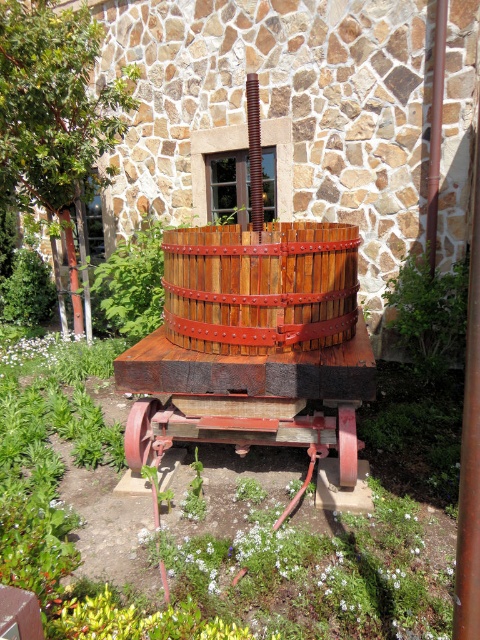
Question: Which point is farther to the camera?

Choices:
 (A) wooden barrel at center
 (B) white matte flower at center
 (C) rustic wood wheel at center

Answer: (B)

Question: Does white matte flower at center have a smaller size compared to rustic wood wheel at center?

Choices:
 (A) no
 (B) yes

Answer: (A)

Question: Estimate the real-world distances between objects in this image. Which object is farther from the rustic wood wheel at center?

Choices:
 (A) white matte flower at center
 (B) wooden barrel at center

Answer: (A)

Question: Does white matte flower at center have a greater width compared to rustic wood wheel at center?

Choices:
 (A) yes
 (B) no

Answer: (A)

Question: Is wooden barrel at center above white matte flower at center?

Choices:
 (A) no
 (B) yes

Answer: (B)

Question: Among these objects, which one is nearest to the camera?

Choices:
 (A) white matte flower at center
 (B) wooden barrel at center
 (C) rustic wood wheel at center

Answer: (B)